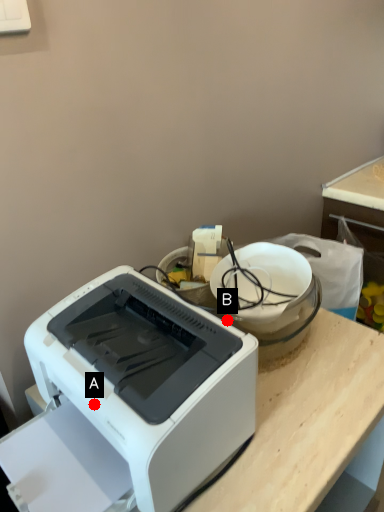
Question: Two points are circled on the image, labeled by A and B beside each circle. Which point is closer to the camera?

Choices:
 (A) A is closer
 (B) B is closer

Answer: (A)